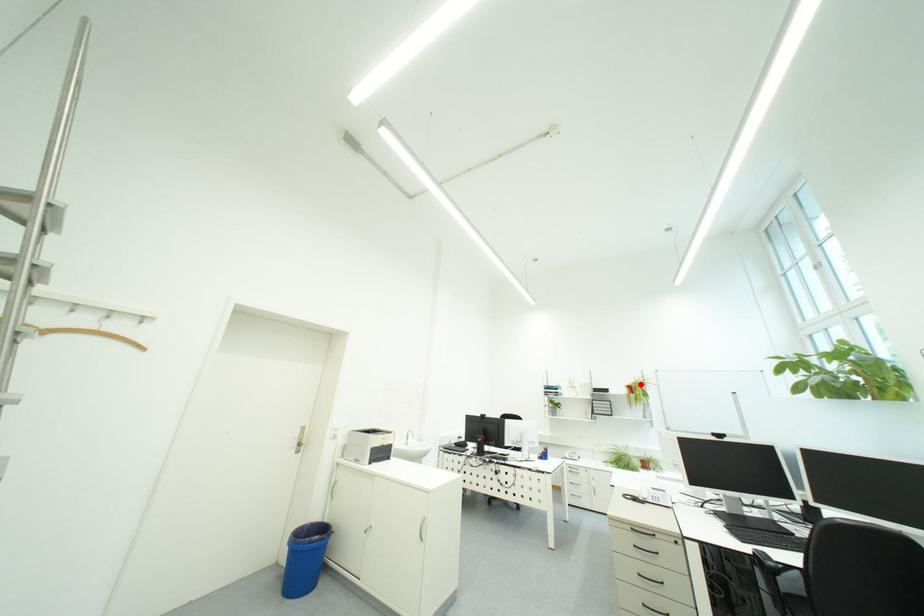
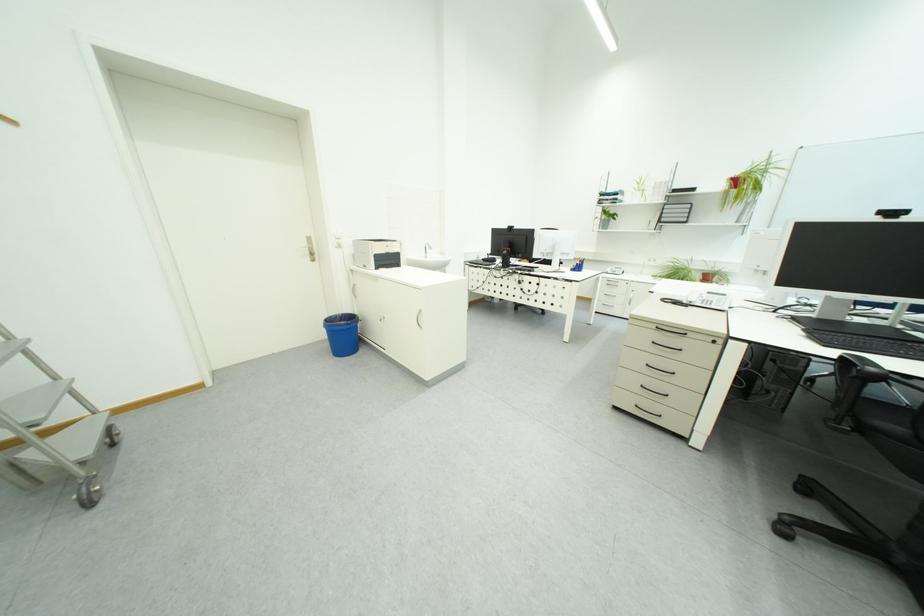
Locate, in the second image, the point that corresponds to the highlighted location in the first image.

(748, 175)